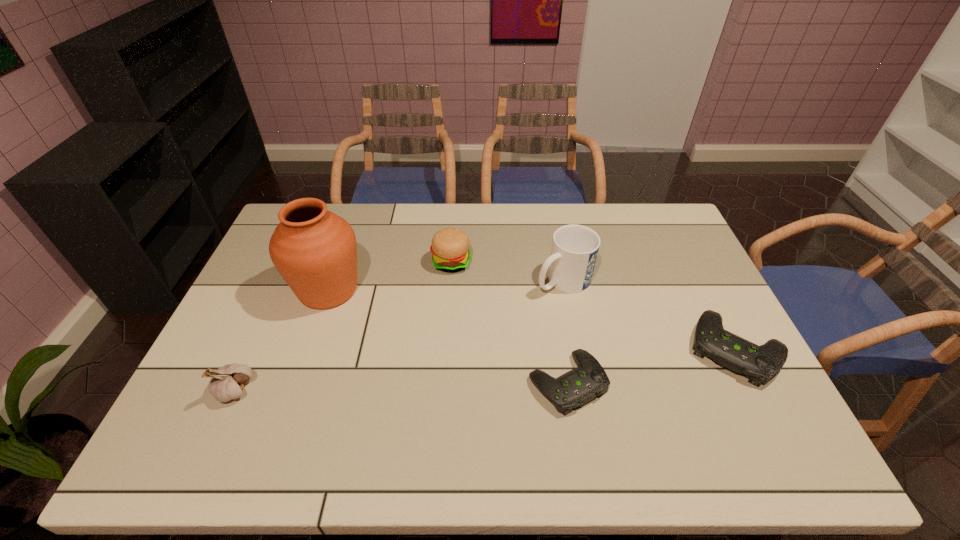
The height and width of the screenshot is (540, 960). I want to click on the shortest object, so click(576, 387).

I want to click on the shorter control, so click(576, 387).

The width and height of the screenshot is (960, 540). In order to click on the fifth tallest object in this screenshot , I will do `click(758, 363)`.

Locate an element on the screen. This screenshot has width=960, height=540. the taller control is located at coordinates (758, 363).

Where is `urn`? The height and width of the screenshot is (540, 960). urn is located at coordinates (315, 251).

Find the location of `mug`. mug is located at coordinates (574, 251).

This screenshot has width=960, height=540. What are the coordinates of `the third object from left to right` in the screenshot? It's located at (450, 246).

This screenshot has width=960, height=540. Find the location of `garlic`. garlic is located at coordinates (227, 382).

This screenshot has width=960, height=540. In order to click on free location located 0.250m on the right of the shortest object in this screenshot , I will do `click(704, 382)`.

This screenshot has width=960, height=540. I want to click on free space located 0.370m on the left of the fifth tallest object, so click(x=554, y=349).